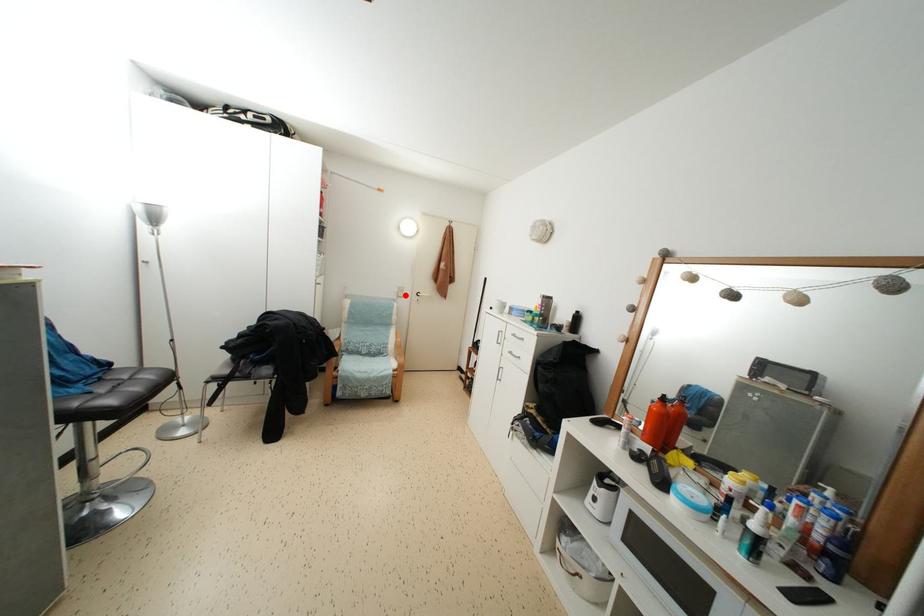
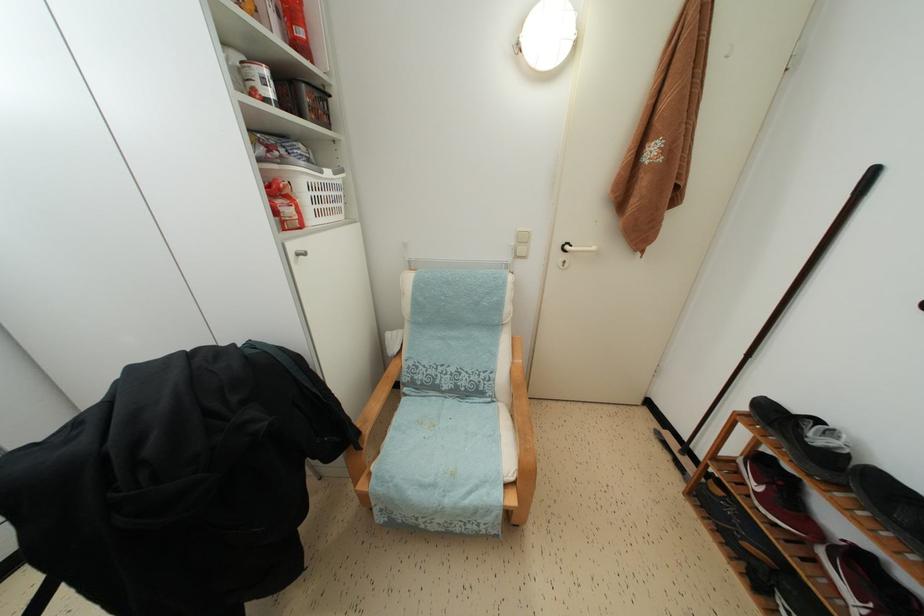
The point at the highlighted location is marked in the first image. Where is the corresponding point in the second image?

(527, 245)